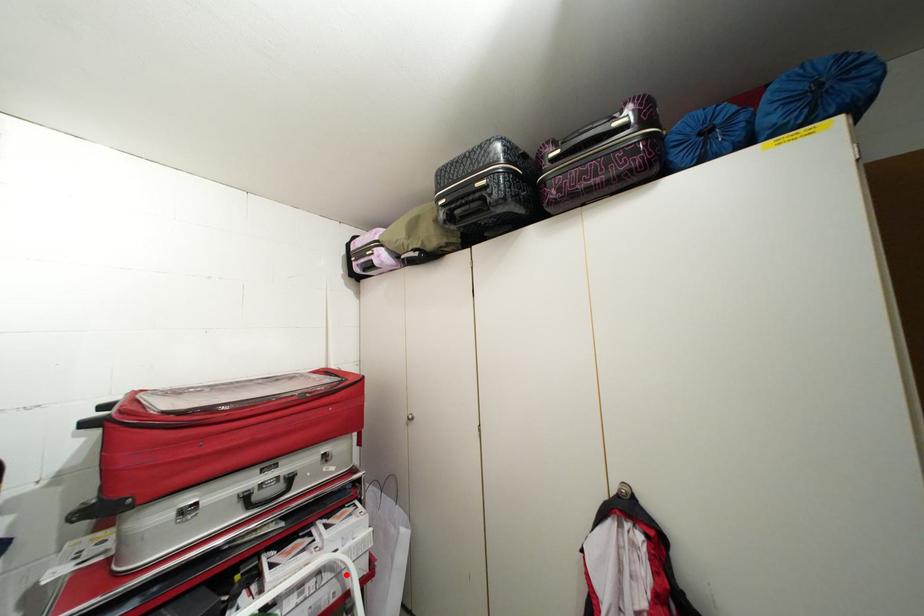
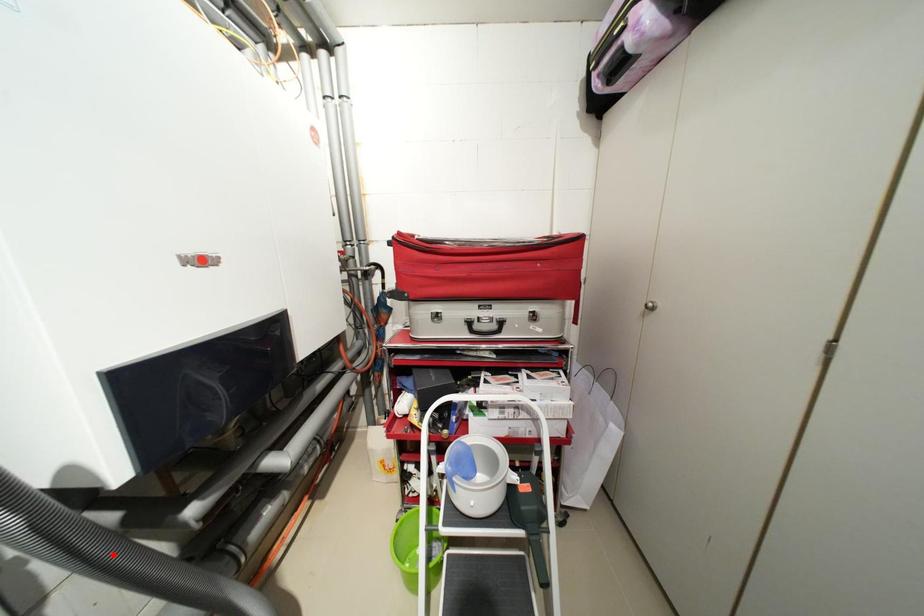
I am providing you with two images of the same scene from different viewpoints. A red point is marked on the first image and another point is marked on the second image. Are the points marked in image1 and image2 representing the same 3D position?

No